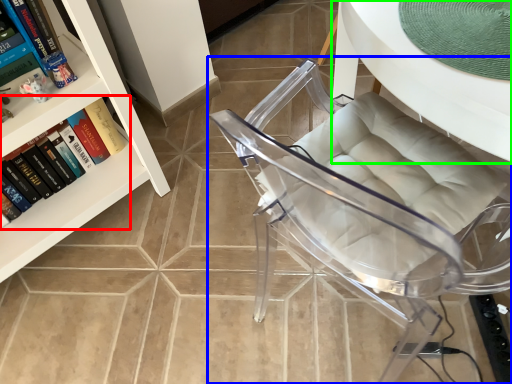
Question: Which object is positioned farthest from book (highlighted by a red box)? Select from chair (highlighted by a blue box) and table (highlighted by a green box).

Choices:
 (A) chair
 (B) table

Answer: (B)